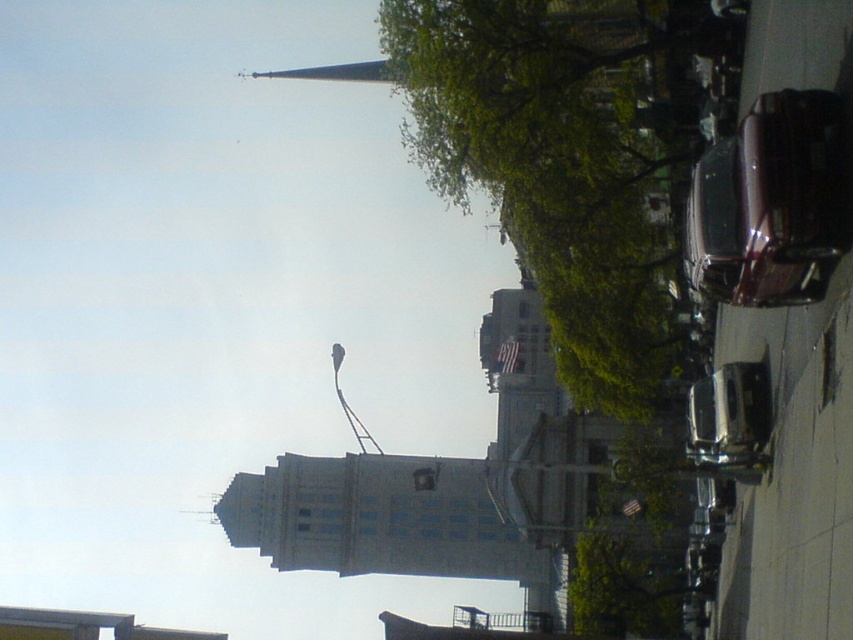
Is shiny maroon car at right thinner than shiny silver sedan at center?

No.

Is shiny maroon car at right behind shiny silver sedan at center?

No, shiny maroon car at right is in front of shiny silver sedan at center.

Image resolution: width=853 pixels, height=640 pixels. Describe the element at coordinates (770, 204) in the screenshot. I see `shiny maroon car at right` at that location.

Find the location of a particular element. shiny maroon car at right is located at coordinates [x=770, y=204].

Can you confirm if green leafy tree at upper center is positioned above shiny silver sedan at center?

Indeed, green leafy tree at upper center is positioned over shiny silver sedan at center.

Who is shorter, green leafy tree at upper center or shiny silver sedan at center?

shiny silver sedan at center

Locate an element on the screen. This screenshot has width=853, height=640. green leafy tree at upper center is located at coordinates (566, 161).

At what (x,y) coordinates should I click in order to perform the action: click on green leafy tree at upper center. Please return your answer as a coordinate pair (x, y). The image size is (853, 640). Looking at the image, I should click on (566, 161).

Does green leafy tree at upper center have a smaller size compared to shiny maroon car at right?

Actually, green leafy tree at upper center might be larger than shiny maroon car at right.

Between point (563, 340) and point (698, 246), which one is positioned behind?

The point (563, 340) is behind.

Image resolution: width=853 pixels, height=640 pixels. In order to click on green leafy tree at upper center in this screenshot , I will do `click(566, 161)`.